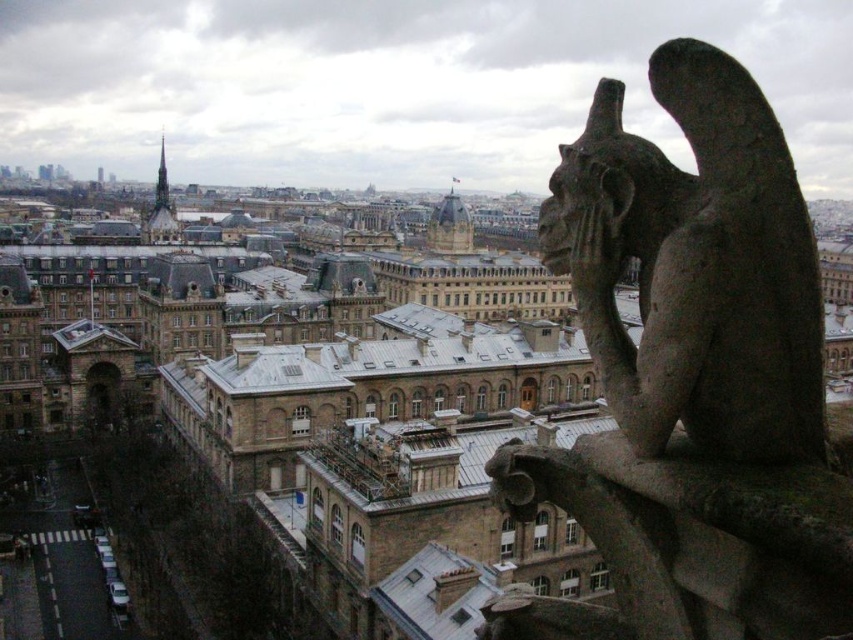
You are an architect analyzing the layout of this historic urban area. You need to determine the relative positions of the dark gray stone gargoyle at upper right and the smooth gray stone tower at upper left. Which of these two objects is positioned lower in the image?

The dark gray stone gargoyle at upper right is located below the smooth gray stone tower at upper left, so the gargoyle is positioned lower in the image.

You are standing at the base of the historic building where the stone gargoyle is located. You see two points marked on a map of the cityscape ahead of you. The first point is at coordinates point (772, 401) and the second is at point (463, 237). Which of these two points is closer to your current position?

Point (772, 401) is in front of point (463, 237), so it is closer to your current position.